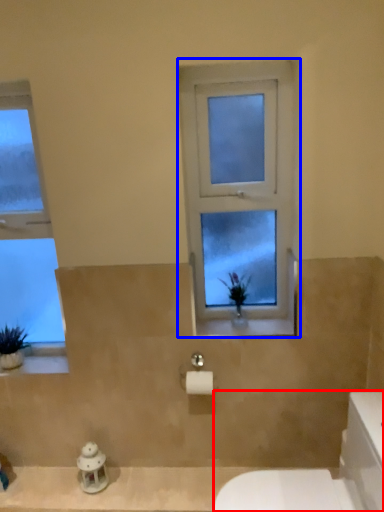
Question: Among these objects, which one is nearest to the camera, porcelain (highlighted by a red box) or window (highlighted by a blue box)?

Choices:
 (A) porcelain
 (B) window

Answer: (A)